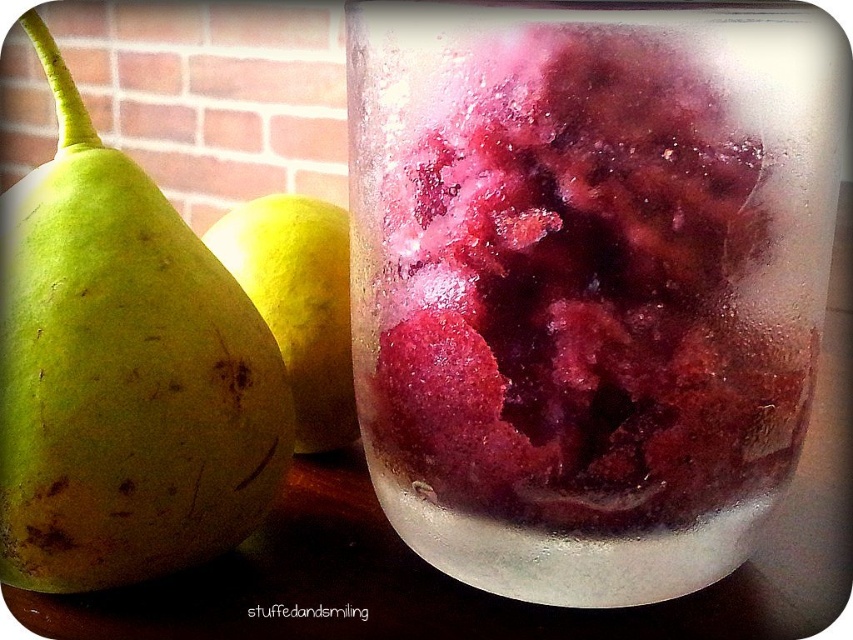
Is frosted glass jar at center taller than green matte pear at left?

Correct, frosted glass jar at center is much taller as green matte pear at left.

Based on the photo, who is positioned more to the right, frosted glass jar at center or green matte pear at left?

frosted glass jar at center

Locate an element on the screen. The height and width of the screenshot is (640, 853). frosted glass jar at center is located at coordinates (589, 284).

At what (x,y) coordinates should I click in order to perform the action: click on frosted glass jar at center. Please return your answer as a coordinate pair (x, y). The width and height of the screenshot is (853, 640). Looking at the image, I should click on (589, 284).

Is green matte pear at left further to the viewer compared to yellow matte pear at center?

No.

Measure the distance between point (12, 436) and camera.

Point (12, 436) is 7.86 inches away from camera.

Locate an element on the screen. The image size is (853, 640). green matte pear at left is located at coordinates (125, 385).

Between frosted glass jar at center and yellow matte pear at center, which one is positioned higher?

yellow matte pear at center

Does frosted glass jar at center appear over yellow matte pear at center?

Incorrect, frosted glass jar at center is not positioned above yellow matte pear at center.

The height and width of the screenshot is (640, 853). What do you see at coordinates (589, 284) in the screenshot?
I see `frosted glass jar at center` at bounding box center [589, 284].

You are a GUI agent. You are given a task and a screenshot of the screen. Output one action in this format:
    pyautogui.click(x=<x>, y=<y>)
    Task: Click on the frosted glass jar at center
    
    Given the screenshot: What is the action you would take?
    pyautogui.click(x=589, y=284)